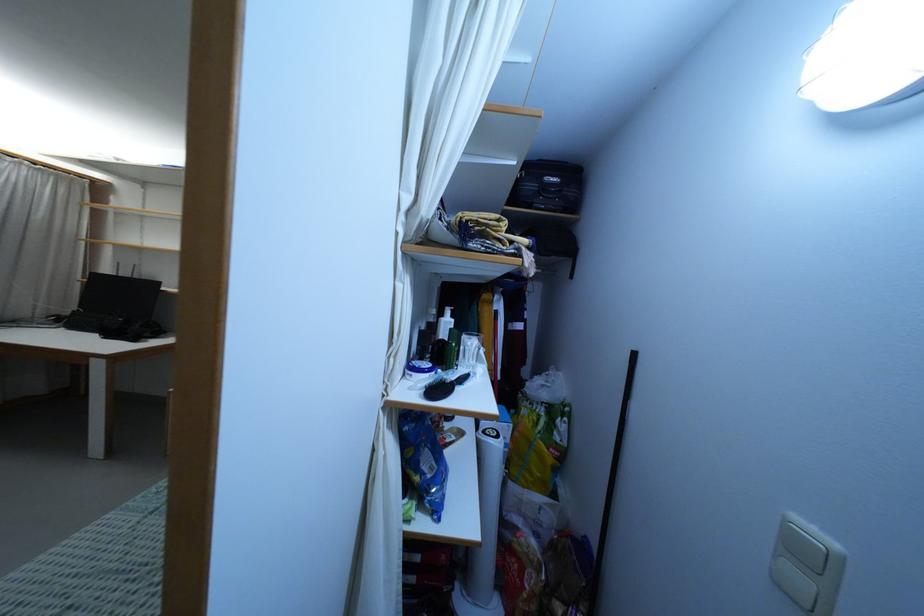
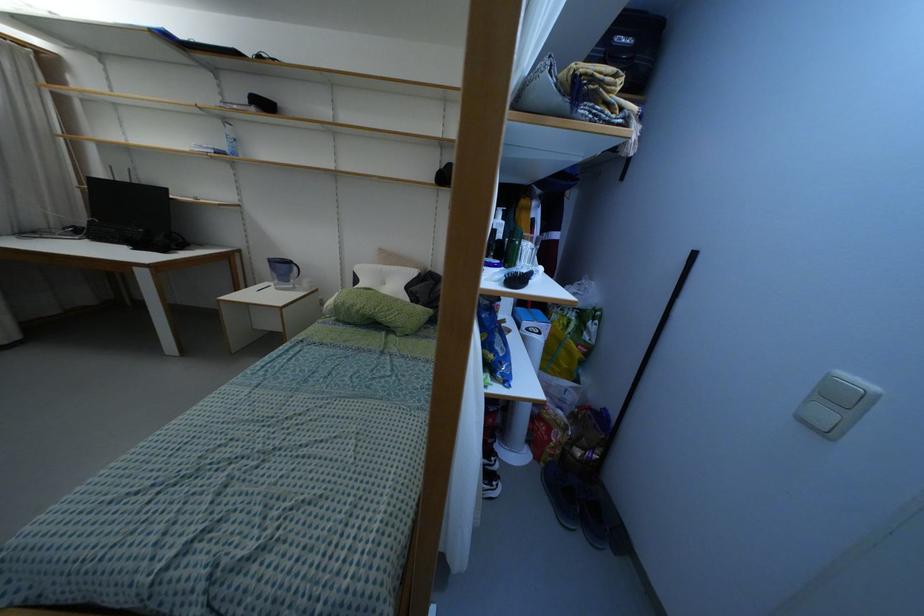
Question: What movement of the cameraman would produce the second image?

Choices:
 (A) Left
 (B) Right
 (C) Forward
 (D) Backward

Answer: (A)